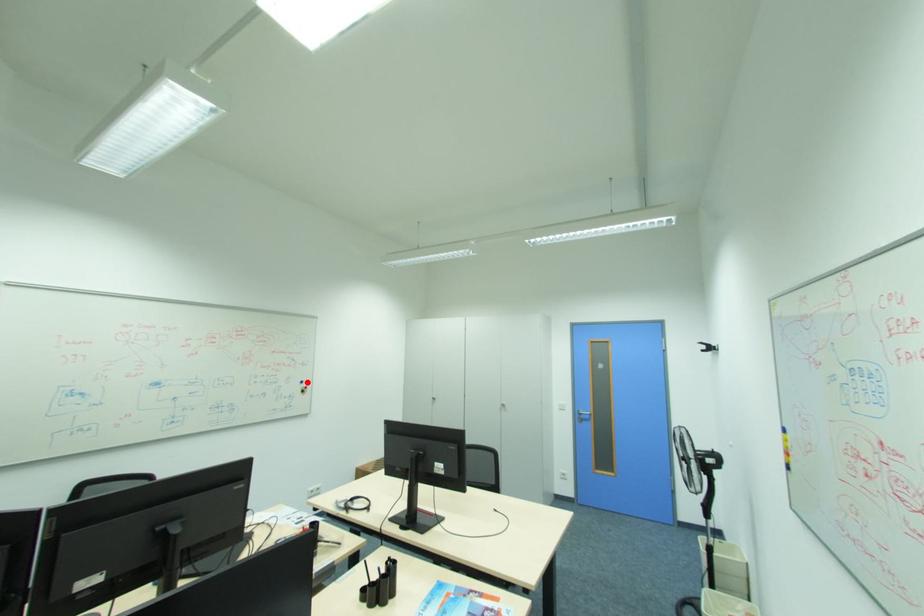
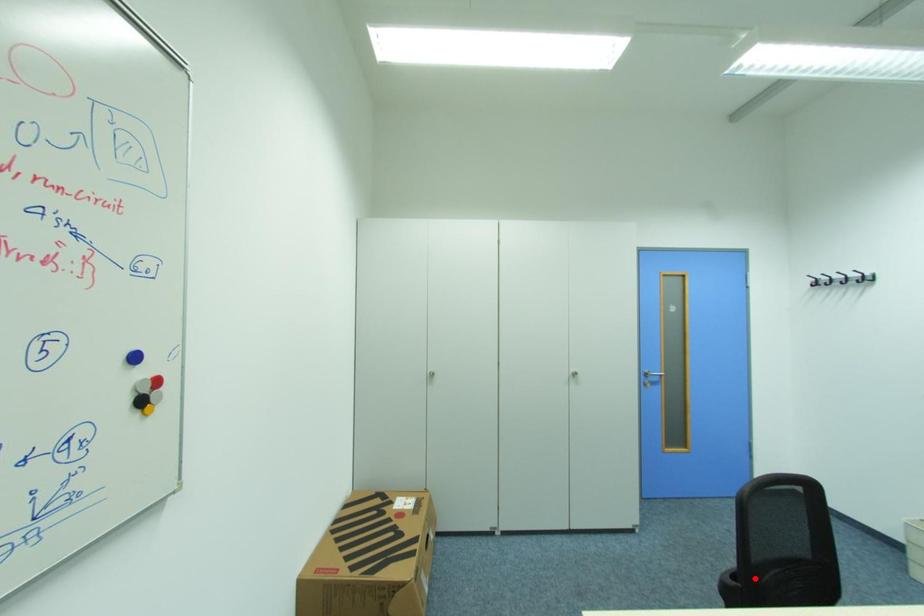
I am providing you with two images of the same scene from different viewpoints. A red point is marked on the first image and another point is marked on the second image. Does the point marked in image1 correspond to the same location as the one in image2?

No